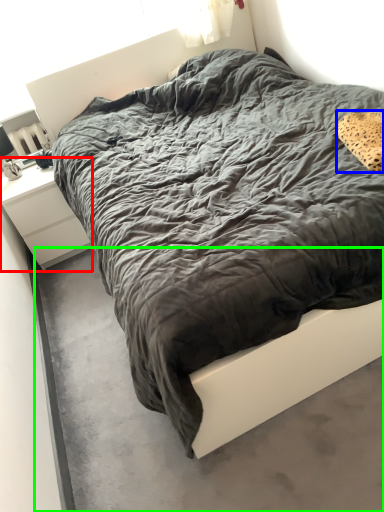
Question: Which object is positioned closest to nightstand (highlighted by a red box)? Select from pillow (highlighted by a blue box) and concrete (highlighted by a green box).

Choices:
 (A) pillow
 (B) concrete

Answer: (B)